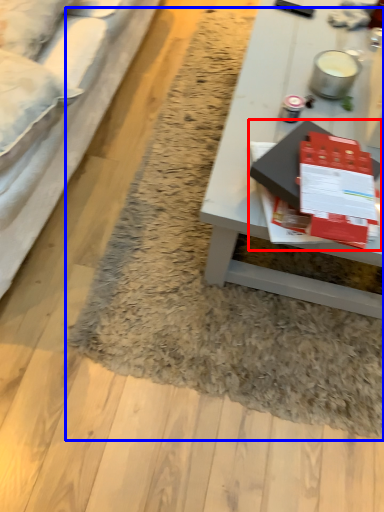
Question: Which object is closer to the camera taking this photo, magazine (highlighted by a red box) or mat (highlighted by a blue box)?

Choices:
 (A) magazine
 (B) mat

Answer: (A)